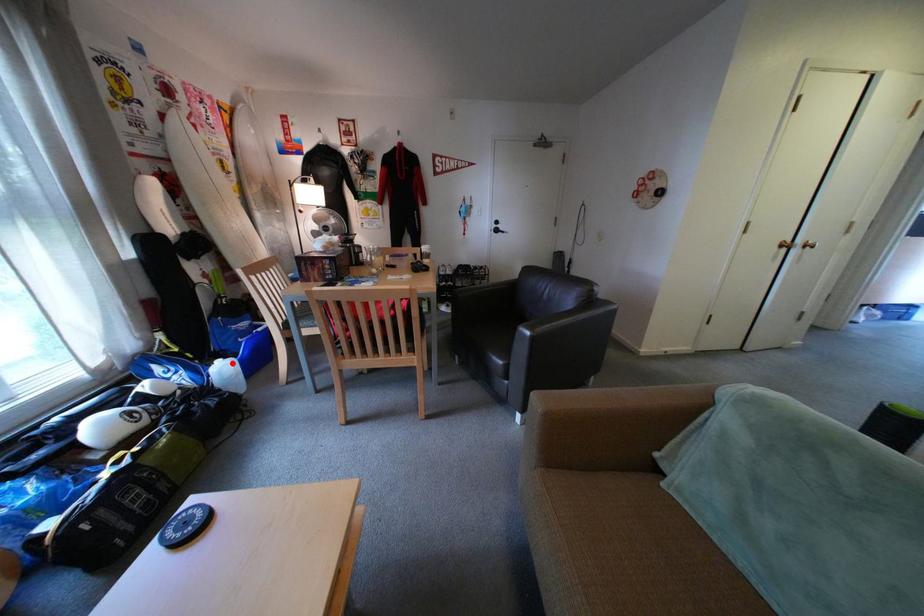
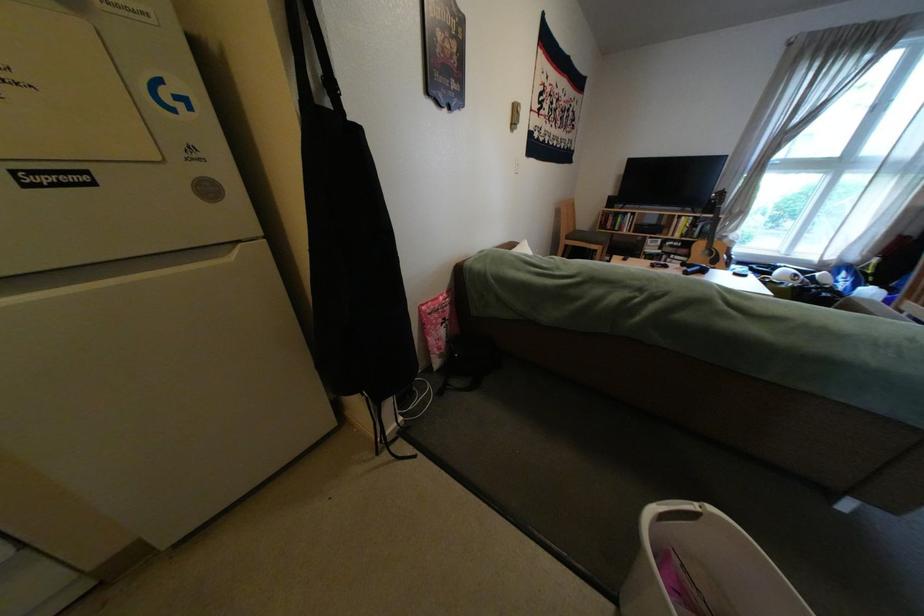
Question: I am providing you with two images of the same scene from different viewpoints. A red point is marked on the first image. Is the red point's position out of view in image 2?

Choices:
 (A) Yes
 (B) No

Answer: (A)